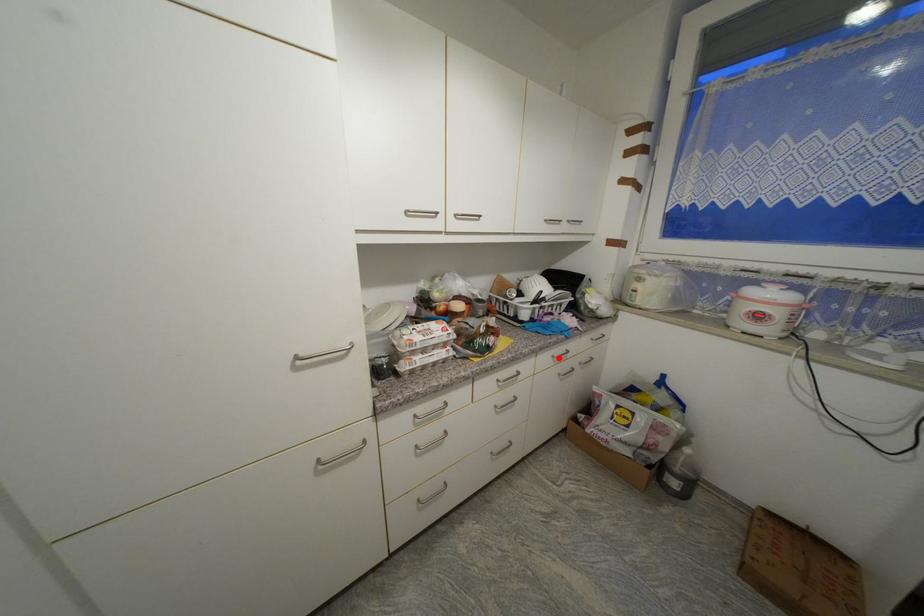
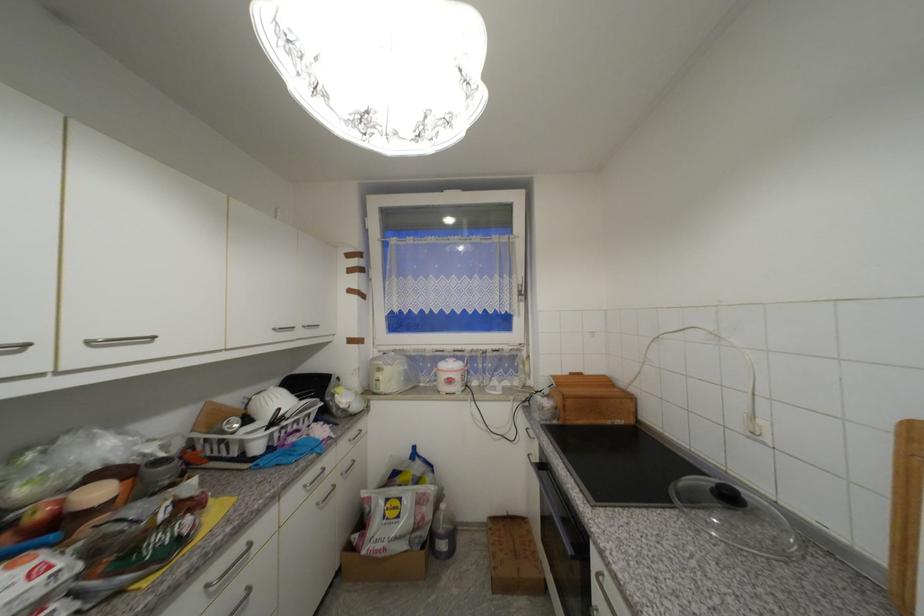
In the second image, find the point that corresponds to the highlighted location in the first image.

(310, 488)